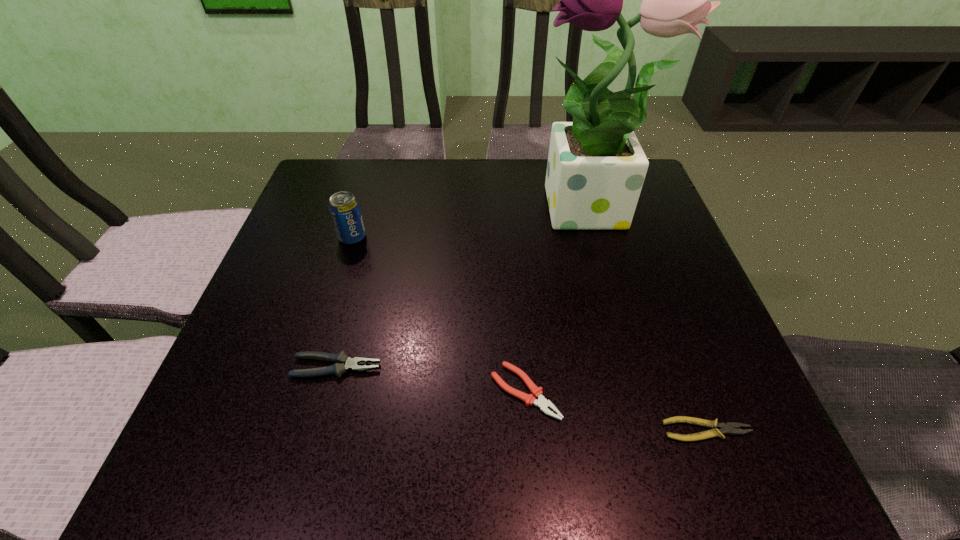
This screenshot has height=540, width=960. I want to click on vacant space located 0.160m on the front-facing side of the tallest object, so click(465, 212).

Locate an element on the screen. free space located on the right of the soda is located at coordinates (406, 238).

Locate an element on the screen. Image resolution: width=960 pixels, height=540 pixels. blank space located at the gripping part of the third shortest object is located at coordinates (427, 367).

Image resolution: width=960 pixels, height=540 pixels. I want to click on vacant region located 0.220m on the right of the second pliers from left to right, so pyautogui.click(x=693, y=392).

Find the location of a particular element. The width and height of the screenshot is (960, 540). blank space located 0.260m on the left of the rightmost pliers is located at coordinates (495, 430).

At what (x,y) coordinates should I click in order to perform the action: click on object present at the far edge. Please return your answer as a coordinate pair (x, y). Looking at the image, I should click on (596, 168).

The image size is (960, 540). Identify the location of soda located in the left edge section of the desktop. (344, 208).

What are the coordinates of `pliers located in the left edge section of the desktop` in the screenshot? It's located at (343, 363).

This screenshot has width=960, height=540. What are the coordinates of `flower arrangement that is at the right edge` in the screenshot? It's located at (596, 168).

Identify the location of pliers at the right edge. (731, 427).